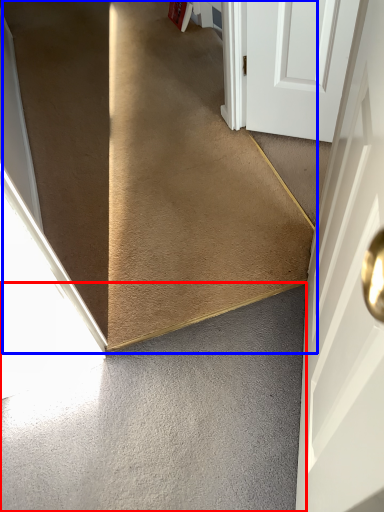
Question: Among these objects, which one is nearest to the camera, concrete (highlighted by a red box) or stairs (highlighted by a blue box)?

Choices:
 (A) concrete
 (B) stairs

Answer: (A)